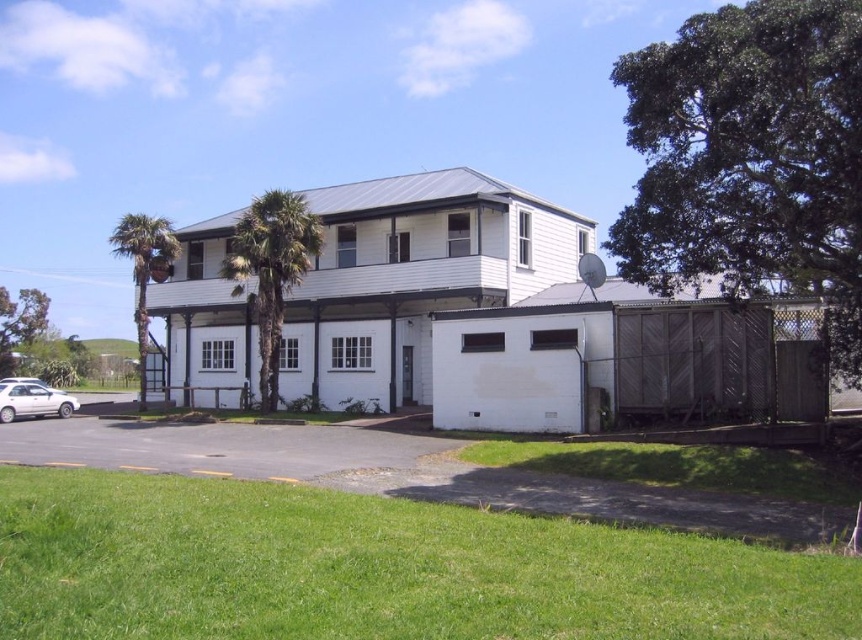
Is green leafy tree at lower left wider than white matte sedan at lower left?

Answer: Correct, the width of green leafy tree at lower left exceeds that of white matte sedan at lower left.

Image resolution: width=862 pixels, height=640 pixels. What do you see at coordinates (19, 323) in the screenshot?
I see `green leafy tree at lower left` at bounding box center [19, 323].

At what (x,y) coordinates should I click in order to perform the action: click on green leafy tree at lower left. Please return your answer as a coordinate pair (x, y). This screenshot has width=862, height=640. Looking at the image, I should click on (19, 323).

Consider the image. Does green leafy palm tree at center appear over white matte sedan at lower left?

Yes, green leafy palm tree at center is above white matte sedan at lower left.

Is point (254, 244) positioned behind point (20, 403)?

No, it is in front of (20, 403).

The width and height of the screenshot is (862, 640). What are the coordinates of `green leafy palm tree at center` in the screenshot? It's located at (270, 269).

The width and height of the screenshot is (862, 640). In order to click on green leafy tree at right in this screenshot , I will do pos(751,157).

Who is taller, green leafy tree at right or green leafy palm tree at left?

With more height is green leafy palm tree at left.

Does point (729, 77) lie in front of point (167, 250)?

Yes, point (729, 77) is in front of point (167, 250).

Identify the location of green leafy tree at right. (751, 157).